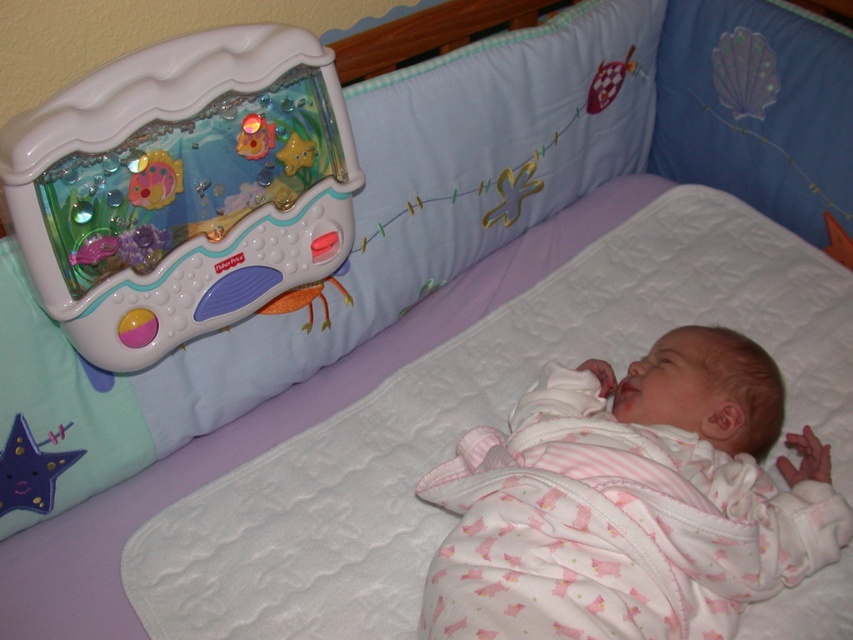
Question: Which point is closer to the camera taking this photo?

Choices:
 (A) (305, 163)
 (B) (148, 163)
 (C) (242, 99)
 (D) (763, 416)

Answer: (B)

Question: Does pink cotton baby at center appear over plastic toy at upper left?

Choices:
 (A) yes
 (B) no

Answer: (B)

Question: Considering the real-world distances, which object is closest to the purple fabric star at lower left?

Choices:
 (A) blue fabric pillow at upper right
 (B) plastic toy at upper left
 (C) matte plastic fish at upper left
 (D) matte plastic pillow at upper left

Answer: (D)

Question: Is purple fabric star at lower left thinner than matte plastic fish at upper left?

Choices:
 (A) yes
 (B) no

Answer: (B)

Question: Is matte plastic fish at upper left to the right of translucent plastic starfish at upper center from the viewer's perspective?

Choices:
 (A) no
 (B) yes

Answer: (A)

Question: Among these objects, which one is nearest to the camera?

Choices:
 (A) matte plastic fish at upper left
 (B) matte plastic pillow at upper left

Answer: (A)